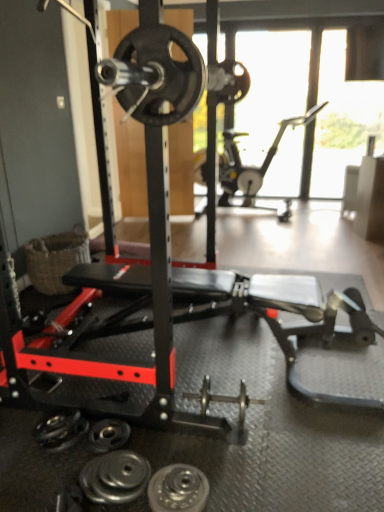
In order to click on free spot above polished silver dumbbell at lower left, the 2th dumbbell from the back (from a real-world perspective) in this screenshot , I will do `click(117, 473)`.